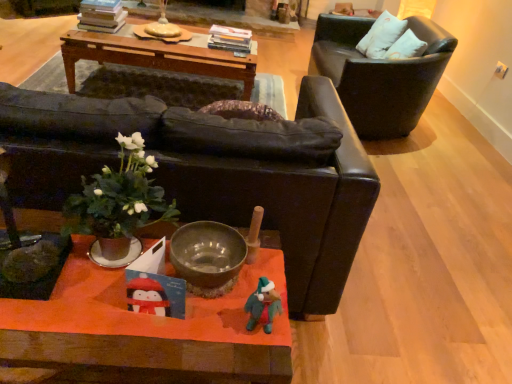
Identify the location of free space on the front side of green leafy plant at center. The image size is (512, 384). (93, 327).